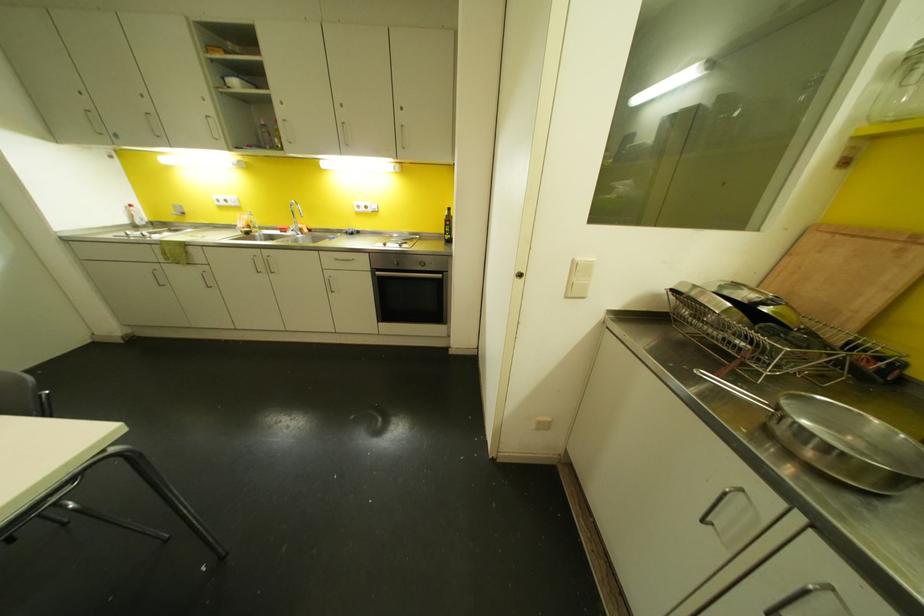
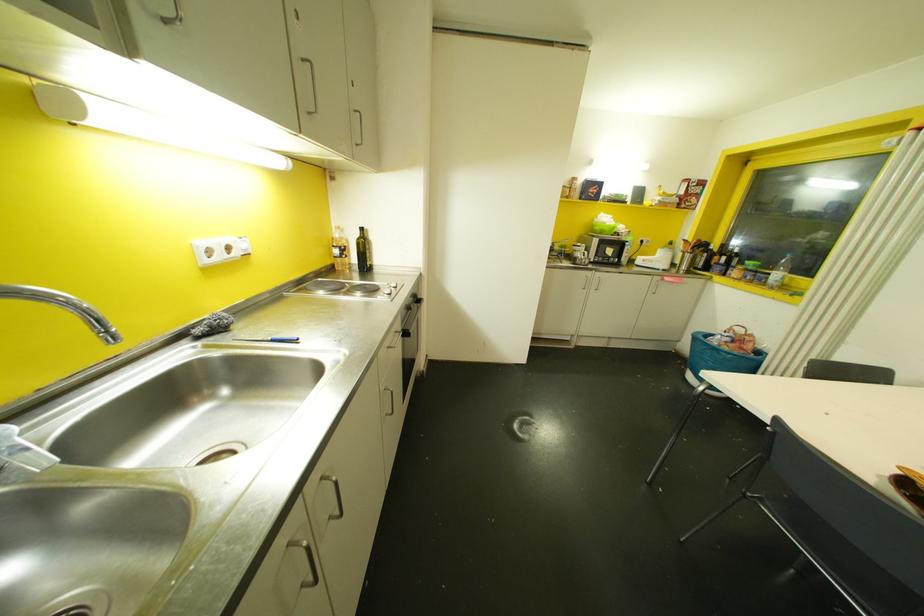
Locate, in the second image, the point that corresponds to (447,209) in the first image.

(360, 229)